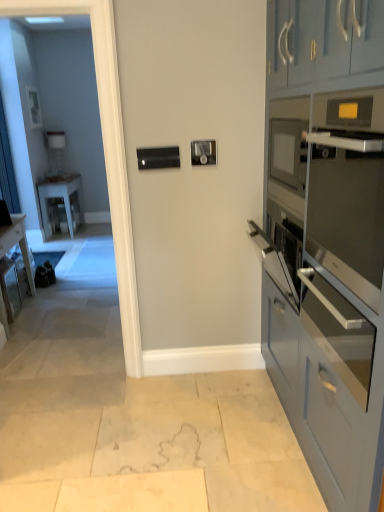
Question: Is matte blue cabinets at right at the left side of white glossy table at left?

Choices:
 (A) yes
 (B) no

Answer: (B)

Question: Can you confirm if matte blue cabinets at right is wider than white glossy table at left?

Choices:
 (A) yes
 (B) no

Answer: (A)

Question: From the image's perspective, is matte blue cabinets at right on top of white glossy table at left?

Choices:
 (A) no
 (B) yes

Answer: (A)

Question: Are matte blue cabinets at right and white glossy table at left making contact?

Choices:
 (A) yes
 (B) no

Answer: (B)

Question: Is matte blue cabinets at right not close to white glossy table at left?

Choices:
 (A) no
 (B) yes

Answer: (B)

Question: From a real-world perspective, is matte blue cabinets at right positioned under white glossy table at left based on gravity?

Choices:
 (A) no
 (B) yes

Answer: (A)

Question: Considering the relative sizes of satin silver oven at right, which is the second oven in top-to-bottom order, and wooden desk at left in the image provided, is satin silver oven at right, which is the second oven in top-to-bottom order, bigger than wooden desk at left?

Choices:
 (A) yes
 (B) no

Answer: (B)

Question: From a real-world perspective, is satin silver oven at right, which is the second oven in top-to-bottom order, physically below wooden desk at left?

Choices:
 (A) no
 (B) yes

Answer: (A)

Question: Is satin silver oven at right, which is the second oven in top-to-bottom order, with wooden desk at left?

Choices:
 (A) yes
 (B) no

Answer: (B)

Question: Does satin silver oven at right, the 1th oven positioned from the bottom, contain wooden desk at left?

Choices:
 (A) no
 (B) yes

Answer: (A)

Question: Is satin silver oven at right, which is the second oven in top-to-bottom order, far from wooden desk at left?

Choices:
 (A) no
 (B) yes

Answer: (B)

Question: Does satin silver oven at right, which is the second oven in top-to-bottom order, have a greater height compared to wooden desk at left?

Choices:
 (A) no
 (B) yes

Answer: (A)

Question: From the image's perspective, would you say matte blue cabinets at right is shown under satin silver oven at right, which is the second oven from bottom to top?

Choices:
 (A) yes
 (B) no

Answer: (A)